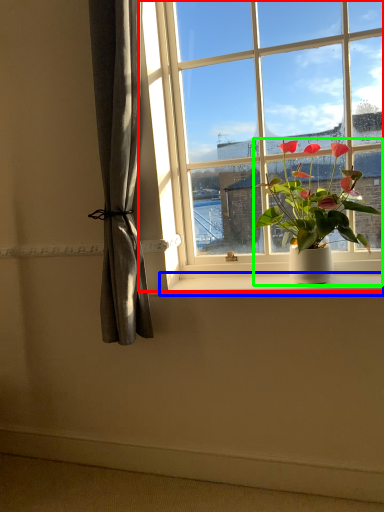
Question: Which is nearer to the window (highlighted by a red box)? window sill (highlighted by a blue box) or houseplant (highlighted by a green box).

Choices:
 (A) window sill
 (B) houseplant

Answer: (B)